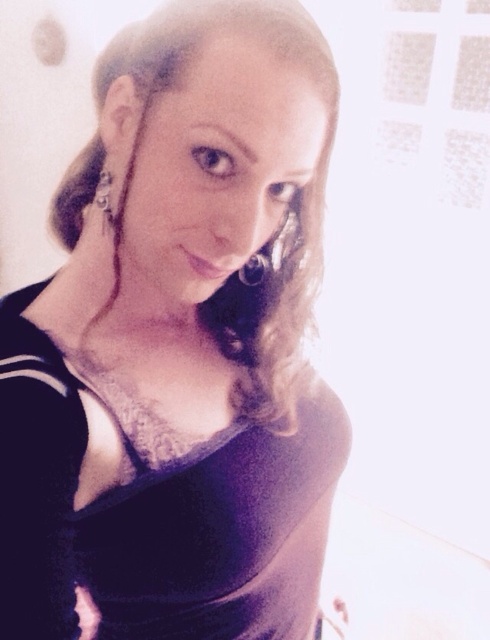
Is point (308, 444) in front of point (100, 177)?

No.

Is matte black dress at center below silver metallic earring at left?

Yes, matte black dress at center is below silver metallic earring at left.

Is point (102, 150) closer to viewer compared to point (104, 196)?

No.

Locate an element on the screen. The image size is (490, 640). matte black dress at center is located at coordinates pyautogui.click(x=178, y=346).